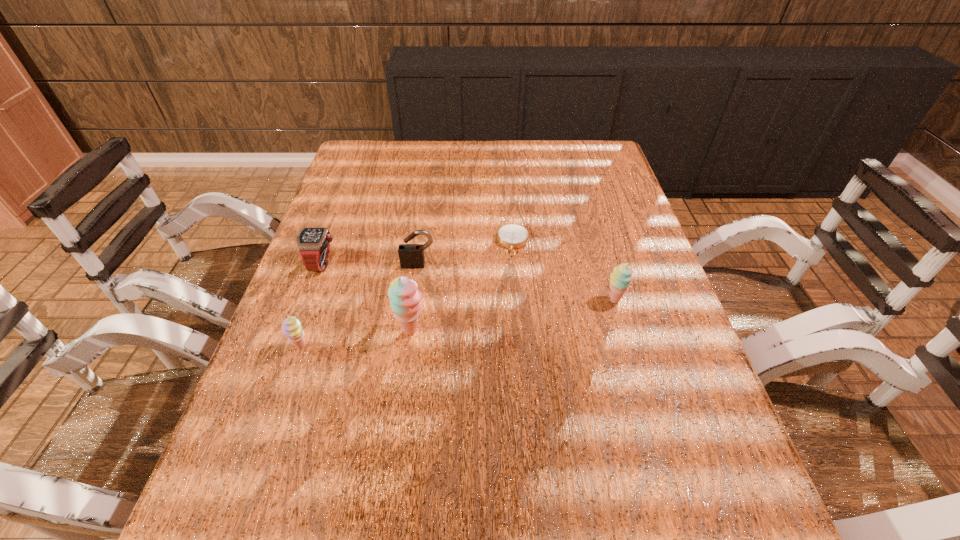
This screenshot has height=540, width=960. In the image, there is a desktop. Find the location of `vacant space at the right edge`. vacant space at the right edge is located at coordinates (643, 239).

In order to click on free space at the far left corner in this screenshot , I will do `click(373, 153)`.

The image size is (960, 540). I want to click on vacant position at the far right corner of the desktop, so click(x=569, y=163).

The width and height of the screenshot is (960, 540). In the image, there is a desktop. Find the location of `vacant space at the near right corner`. vacant space at the near right corner is located at coordinates (653, 447).

Identify the location of free point between the compass and the padlock. The width and height of the screenshot is (960, 540). (466, 254).

Identify the location of unoccupied area between the third nearest object and the leftmost sherbert. click(x=457, y=323).

Identify the location of vacant region between the watch and the leftmost sherbert. The height and width of the screenshot is (540, 960). [311, 305].

Find the location of a particular element. free space between the tallest sherbert and the shortest sherbert is located at coordinates pos(356,339).

At what (x,y) coordinates should I click in order to perform the action: click on free space between the shortest sherbert and the padlock. Please return your answer as a coordinate pair (x, y). Looking at the image, I should click on (359, 306).

You are a GUI agent. You are given a task and a screenshot of the screen. Output one action in this format:
    pyautogui.click(x=<x>, y=<y>)
    Task: Click on the empty location between the third nearest object and the padlock
    This screenshot has height=540, width=960.
    Given the screenshot: What is the action you would take?
    pyautogui.click(x=516, y=282)